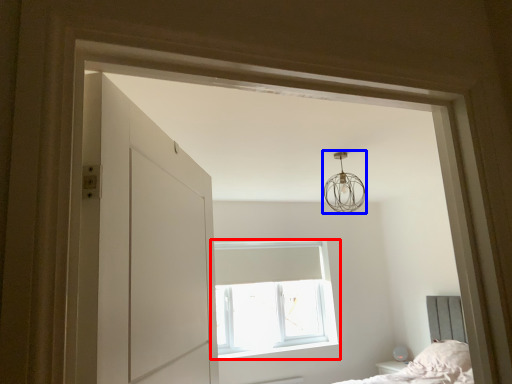
Question: Which object is further to the camera taking this photo, window (highlighted by a red box) or lamp (highlighted by a blue box)?

Choices:
 (A) window
 (B) lamp

Answer: (A)